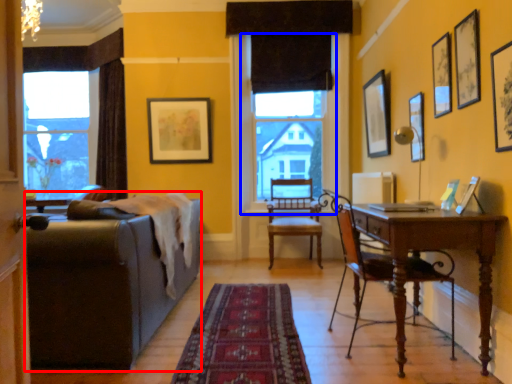
Question: Which point is further to the camera, studio couch (highlighted by a red box) or window screen (highlighted by a blue box)?

Choices:
 (A) studio couch
 (B) window screen

Answer: (B)